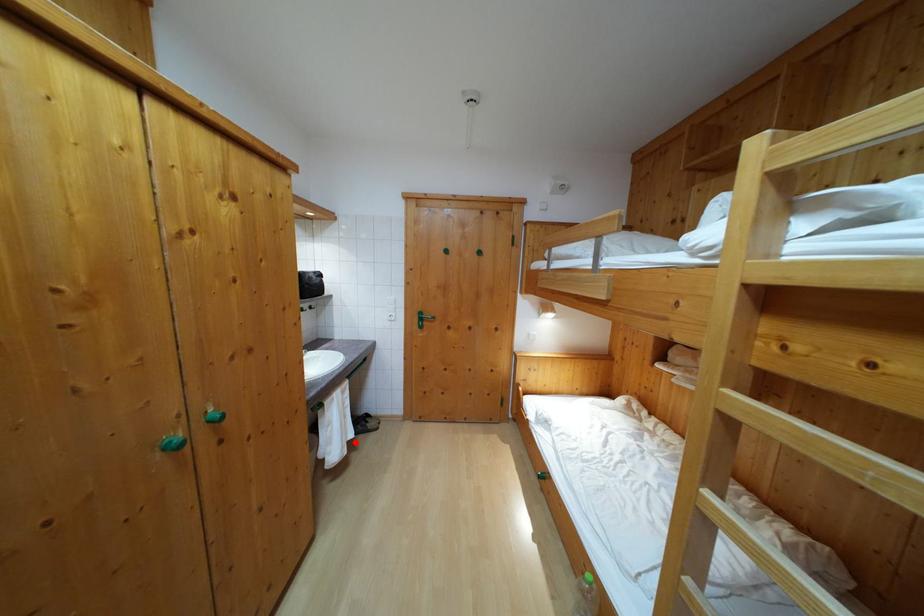
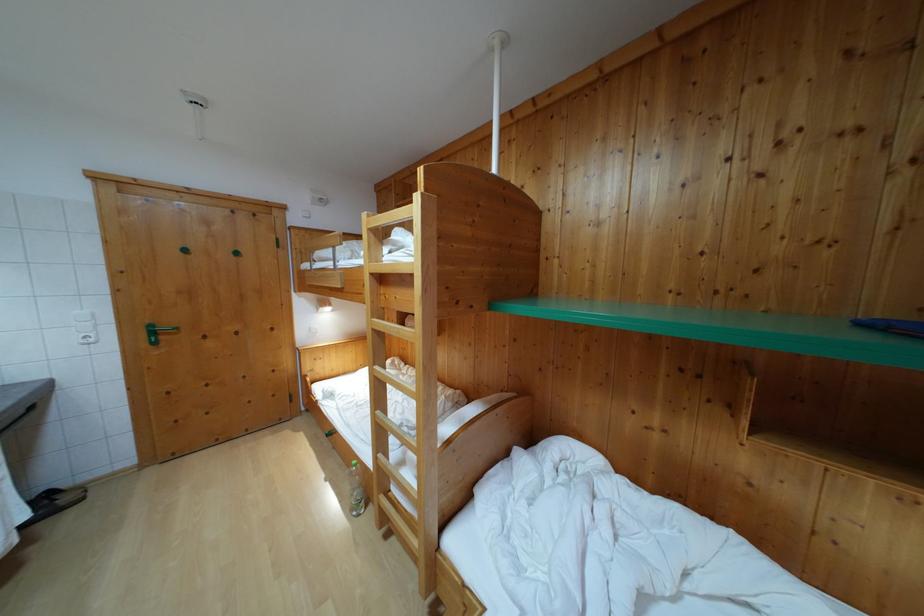
Question: I am providing you with two images of the same scene from different viewpoints. Given a red point in image1, look at the same physical point in image2. Is it:

Choices:
 (A) Closer to the viewpoint
 (B) Farther from the viewpoint

Answer: (B)